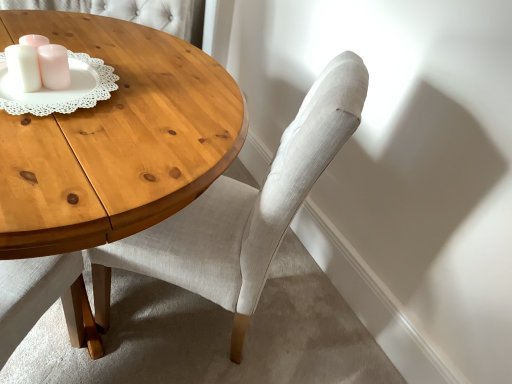
Question: From a real-world perspective, is white matte candle holder at upper left physically above light gray fabric chair at center?

Choices:
 (A) yes
 (B) no

Answer: (A)

Question: Is white matte candle holder at upper left bigger than light gray fabric chair at center?

Choices:
 (A) yes
 (B) no

Answer: (B)

Question: Is white matte candle holder at upper left taller than light gray fabric chair at center?

Choices:
 (A) yes
 (B) no

Answer: (B)

Question: Can you confirm if white matte candle holder at upper left is positioned to the right of light gray fabric chair at center?

Choices:
 (A) yes
 (B) no

Answer: (B)

Question: From the image's perspective, is white matte candle holder at upper left below light gray fabric chair at center?

Choices:
 (A) no
 (B) yes

Answer: (A)

Question: From a real-world perspective, does white matte candle holder at upper left sit lower than light gray fabric chair at center?

Choices:
 (A) no
 (B) yes

Answer: (A)

Question: Is light gray fabric chair at center completely or partially outside of white matte candle holder at upper left?

Choices:
 (A) yes
 (B) no

Answer: (A)

Question: Is light gray fabric chair at center positioned behind white matte candle holder at upper left?

Choices:
 (A) yes
 (B) no

Answer: (B)

Question: Is light gray fabric chair at center taller than white matte candle holder at upper left?

Choices:
 (A) yes
 (B) no

Answer: (A)

Question: Is light gray fabric chair at center thinner than white matte candle holder at upper left?

Choices:
 (A) no
 (B) yes

Answer: (A)

Question: Is light gray fabric chair at center at the right side of white matte candle holder at upper left?

Choices:
 (A) no
 (B) yes

Answer: (B)

Question: Can you confirm if light gray fabric chair at center is smaller than white matte candle holder at upper left?

Choices:
 (A) yes
 (B) no

Answer: (B)

Question: Considering the positions of light gray fabric chair at center and white matte candle holder at upper left in the image, is light gray fabric chair at center wider or thinner than white matte candle holder at upper left?

Choices:
 (A) wide
 (B) thin

Answer: (A)